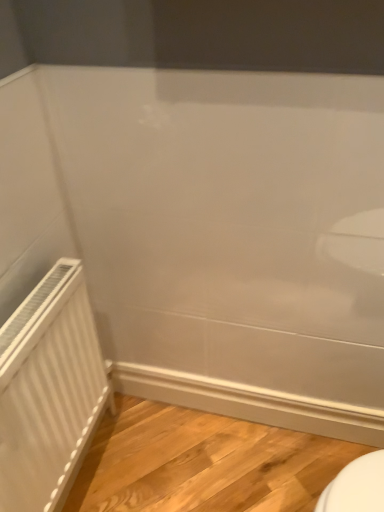
The image size is (384, 512). In order to click on white textured radiator at left in this screenshot , I will do `click(49, 391)`.

What do you see at coordinates (49, 391) in the screenshot? I see `white textured radiator at left` at bounding box center [49, 391].

The width and height of the screenshot is (384, 512). I want to click on white textured radiator at left, so click(49, 391).